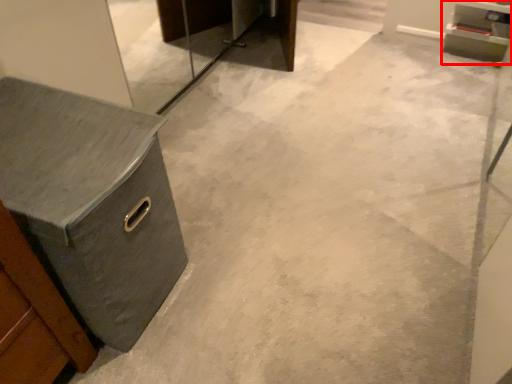
Question: Observing the image, what is the correct spatial positioning of cabinetry (annotated by the red box) in reference to chest of drawers?

Choices:
 (A) left
 (B) right

Answer: (B)